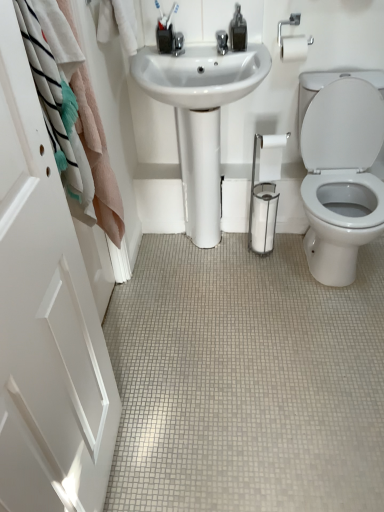
Question: From their relative heights in the image, would you say white matte toilet paper at center is taller or shorter than white tile floor at center?

Choices:
 (A) short
 (B) tall

Answer: (B)

Question: From the image's perspective, is white matte toilet paper at center positioned above or below white tile floor at center?

Choices:
 (A) above
 (B) below

Answer: (A)

Question: Considering the real-world distances, which object is closest to the white glossy sink at center?

Choices:
 (A) white tile floor at center
 (B) white cotton towel at left
 (C) white matte toilet paper at center
 (D) white glossy door at left

Answer: (C)

Question: Estimate the real-world distances between objects in this image. Which object is closer to the white tile floor at center?

Choices:
 (A) white matte toilet paper at center
 (B) white glossy sink at center
 (C) white glossy door at left
 (D) white cotton towel at left

Answer: (C)